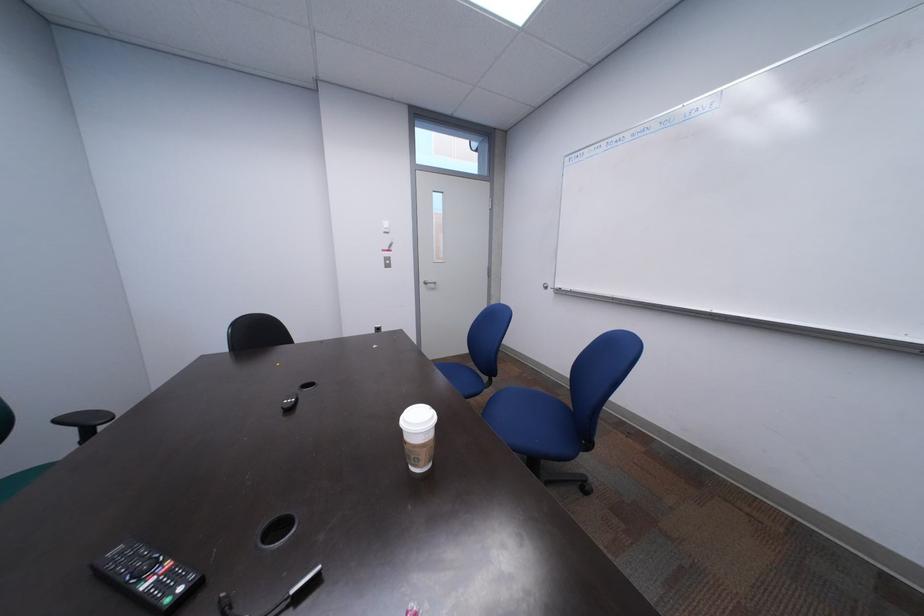
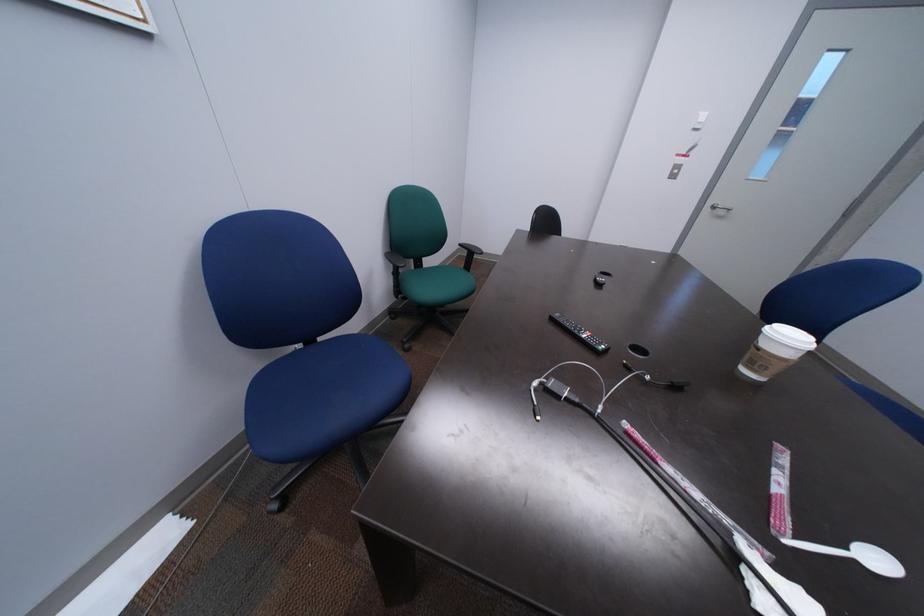
Consider the image. Based on the continuous images, in which direction is the camera rotating?

The rotation direction of the camera is left-down.